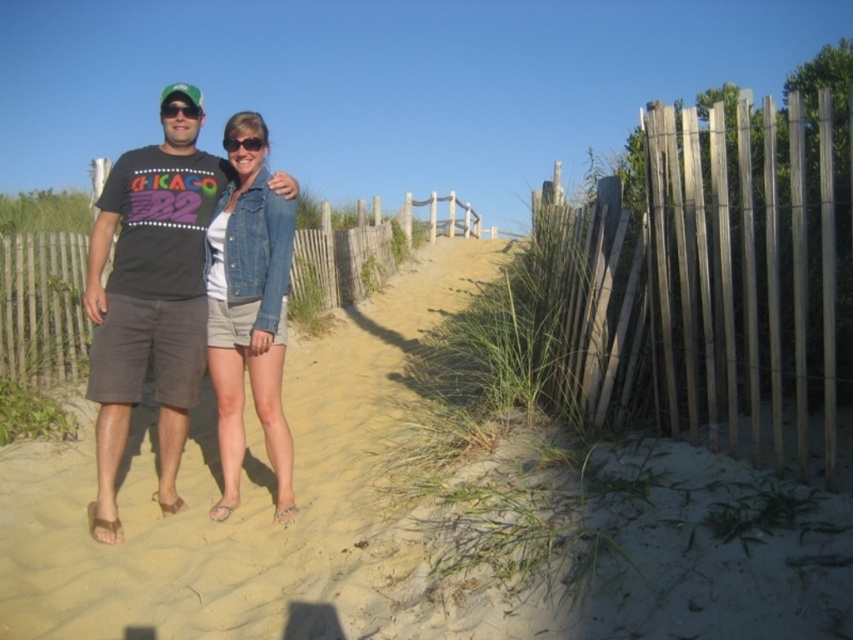
What do you see at coordinates (395, 522) in the screenshot? The height and width of the screenshot is (640, 853). I see `beige sandy path at center` at bounding box center [395, 522].

Can you confirm if beige sandy path at center is taller than matte black t-shirt at center?

In fact, beige sandy path at center may be shorter than matte black t-shirt at center.

At what (x,y) coordinates should I click in order to perform the action: click on beige sandy path at center. Please return your answer as a coordinate pair (x, y). Looking at the image, I should click on (395, 522).

The image size is (853, 640). Identify the location of beige sandy path at center. (395, 522).

Is point (770, 248) closer to camera compared to point (292, 228)?

Yes, it is.

Is point (645, 300) positioned before point (254, 339)?

Yes, it is in front of point (254, 339).

Locate an element on the screen. Image resolution: width=853 pixels, height=640 pixels. weathered wood fence at right is located at coordinates (711, 282).

Consider the image. Does matte black t-shirt at center have a smaller size compared to denim jacket at center?

Actually, matte black t-shirt at center might be larger than denim jacket at center.

Can you confirm if matte black t-shirt at center is taller than denim jacket at center?

Yes, matte black t-shirt at center is taller than denim jacket at center.

You are a GUI agent. You are given a task and a screenshot of the screen. Output one action in this format:
    pyautogui.click(x=<x>, y=<y>)
    Task: Click on the matte black t-shirt at center
    The height and width of the screenshot is (640, 853).
    Given the screenshot: What is the action you would take?
    pyautogui.click(x=149, y=300)